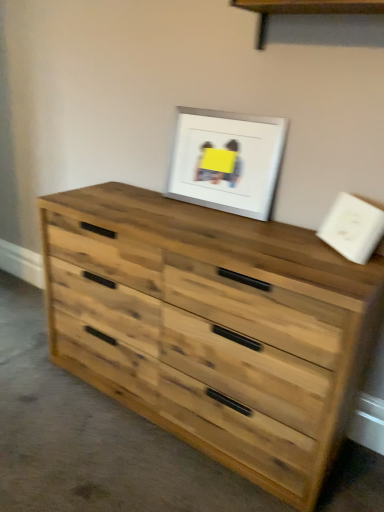
The width and height of the screenshot is (384, 512). What do you see at coordinates (304, 10) in the screenshot?
I see `wooden shelf at upper center` at bounding box center [304, 10].

Describe the element at coordinates (226, 161) in the screenshot. I see `white matte picture frame at upper center` at that location.

Find the location of a particular element. wooden shelf at upper center is located at coordinates (304, 10).

In terms of width, does wooden shelf at upper center look wider or thinner when compared to white matte picture frame at upper center?

wooden shelf at upper center is wider than white matte picture frame at upper center.

Which point is more forward, [341,6] or [201,163]?

Positioned in front is point [341,6].

Does wooden shelf at upper center appear on the right side of white matte picture frame at upper center?

Yes.

Where is `picture frame located below the wooden shelf at upper center (from the image's perspective)`? The image size is (384, 512). picture frame located below the wooden shelf at upper center (from the image's perspective) is located at coordinates (226, 161).

Who is shorter, natural wood chest of drawers at center or wooden shelf at upper center?

With less height is wooden shelf at upper center.

Which is closer, (299, 303) or (378, 0)?

Point (299, 303) is positioned closer to the camera compared to point (378, 0).

Considering the sizes of objects natural wood chest of drawers at center and wooden shelf at upper center in the image provided, who is wider, natural wood chest of drawers at center or wooden shelf at upper center?

natural wood chest of drawers at center is wider.

From the image's perspective, is white matte picture frame at upper center above wooden shelf at upper center?

No, from the image's perspective, white matte picture frame at upper center is not on top of wooden shelf at upper center.

Is white matte picture frame at upper center at the left side of wooden shelf at upper center?

Yes.

Can wooden shelf at upper center be found inside white matte picture frame at upper center?

No, wooden shelf at upper center is not a part of white matte picture frame at upper center.

From a real-world perspective, is natural wood chest of drawers at center above or below white matte picture frame at upper center?

natural wood chest of drawers at center is situated lower than white matte picture frame at upper center in the real world.

Considering the relative positions of natural wood chest of drawers at center and white matte picture frame at upper center in the image provided, is natural wood chest of drawers at center in front of white matte picture frame at upper center?

Yes, natural wood chest of drawers at center is closer to the camera.

Is point (124, 280) closer or farther from the camera than point (171, 185)?

Point (124, 280) appears to be closer to the viewer than point (171, 185).

Considering the relative sizes of natural wood chest of drawers at center and white matte picture frame at upper center in the image provided, is natural wood chest of drawers at center shorter than white matte picture frame at upper center?

No, natural wood chest of drawers at center is not shorter than white matte picture frame at upper center.

Between wooden shelf at upper center and natural wood chest of drawers at center, which one has less height?

With less height is wooden shelf at upper center.

Which is farther from the camera, [262,3] or [255,245]?

The point [262,3] is behind.

You are a GUI agent. You are given a task and a screenshot of the screen. Output one action in this format:
    pyautogui.click(x=<x>, y=<y>)
    Task: Click on the chest of drawers below the wooden shelf at upper center (from a real-world perspective)
    
    Given the screenshot: What is the action you would take?
    pyautogui.click(x=213, y=327)

Is natural wood chest of drawers at center surrounded by wooden shelf at upper center?

Actually, natural wood chest of drawers at center is outside wooden shelf at upper center.

From the picture: Does white matte picture frame at upper center turn towards natural wood chest of drawers at center?

No.

Between white matte picture frame at upper center and natural wood chest of drawers at center, which one has larger size?

With larger size is natural wood chest of drawers at center.

From the image's perspective, is white matte picture frame at upper center beneath natural wood chest of drawers at center?

No, from the image's perspective, white matte picture frame at upper center is not below natural wood chest of drawers at center.

Which object is positioned more to the left, white matte picture frame at upper center or natural wood chest of drawers at center?

Positioned to the left is natural wood chest of drawers at center.

This screenshot has width=384, height=512. In order to click on picture frame behind the wooden shelf at upper center in this screenshot , I will do `click(226, 161)`.

The width and height of the screenshot is (384, 512). What are the coordinates of `the chest of drawers that is below the wooden shelf at upper center (from the image's perspective)` in the screenshot? It's located at (213, 327).

Estimate the real-world distances between objects in this image. Which object is closer to white matte picture frame at upper center, wooden shelf at upper center or natural wood chest of drawers at center?

Based on the image, wooden shelf at upper center appears to be nearer to white matte picture frame at upper center.

When comparing their distances from wooden shelf at upper center, does natural wood chest of drawers at center or white matte picture frame at upper center seem further?

natural wood chest of drawers at center.

Considering their positions, is white matte picture frame at upper center positioned further to wooden shelf at upper center than natural wood chest of drawers at center?

natural wood chest of drawers at center lies further to wooden shelf at upper center than the other object.

Estimate the real-world distances between objects in this image. Which object is further from white matte picture frame at upper center, natural wood chest of drawers at center or wooden shelf at upper center?

natural wood chest of drawers at center is further to white matte picture frame at upper center.

Estimate the real-world distances between objects in this image. Which object is closer to natural wood chest of drawers at center, wooden shelf at upper center or white matte picture frame at upper center?

white matte picture frame at upper center.

Considering their positions, is white matte picture frame at upper center positioned further to natural wood chest of drawers at center than wooden shelf at upper center?

The object further to natural wood chest of drawers at center is wooden shelf at upper center.

At what (x,y) coordinates should I click in order to perform the action: click on picture frame between wooden shelf at upper center and natural wood chest of drawers at center from top to bottom. Please return your answer as a coordinate pair (x, y). Looking at the image, I should click on (226, 161).